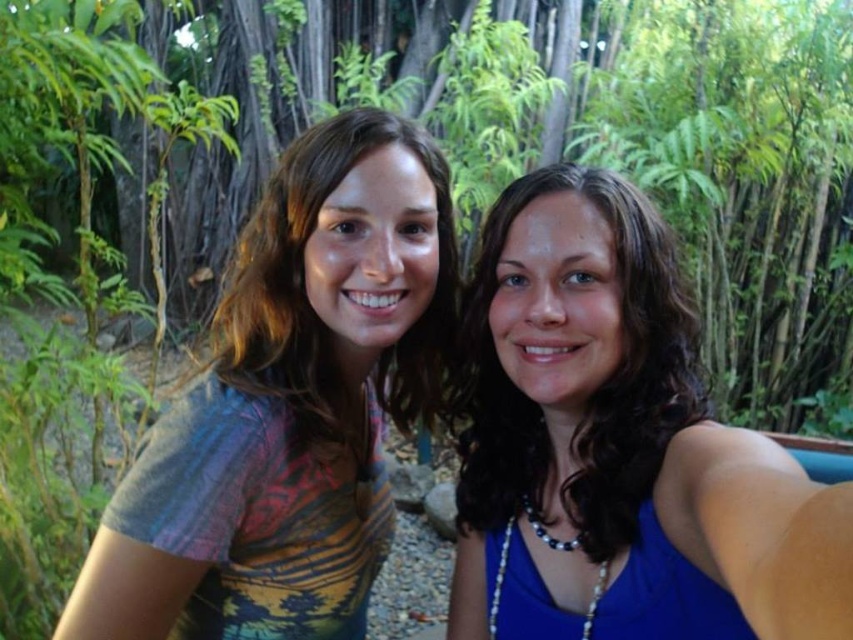
Is point (848, 488) behind point (97, 557)?

That is False.

Which is behind, point (605, 237) or point (352, 276)?

The point (352, 276) is more distant.

Image resolution: width=853 pixels, height=640 pixels. I want to click on blue silk tank top at center, so click(x=619, y=444).

Is multicolored fabric shirt at left wider than multicolored fabric at center?

No.

Is multicolored fabric shirt at left smaller than multicolored fabric at center?

Yes, multicolored fabric shirt at left is smaller than multicolored fabric at center.

Image resolution: width=853 pixels, height=640 pixels. Identify the location of multicolored fabric shirt at left. point(289,404).

Where is `multicolored fabric shirt at left`? multicolored fabric shirt at left is located at coordinates (289, 404).

Between green leafy tree at center and multicolored fabric at center, which one is positioned lower?

multicolored fabric at center

Who is shorter, green leafy tree at center or multicolored fabric at center?

With less height is multicolored fabric at center.

Which is in front, point (784, 323) or point (251, 269)?

Point (251, 269) is in front.

You are a GUI agent. You are given a task and a screenshot of the screen. Output one action in this format:
    pyautogui.click(x=<x>, y=<y>)
    Task: Click on the green leafy tree at center
    
    Given the screenshot: What is the action you would take?
    pyautogui.click(x=508, y=136)